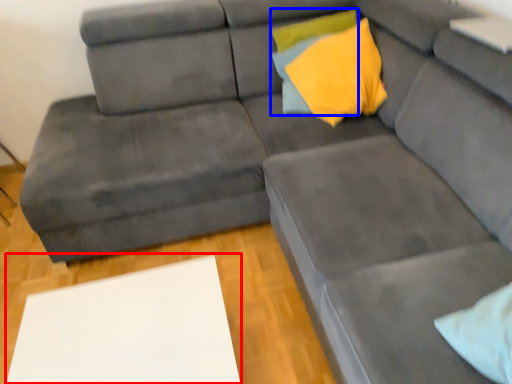
Question: Which point is closer to the camera, table (highlighted by a red box) or pillow (highlighted by a blue box)?

Choices:
 (A) table
 (B) pillow

Answer: (A)